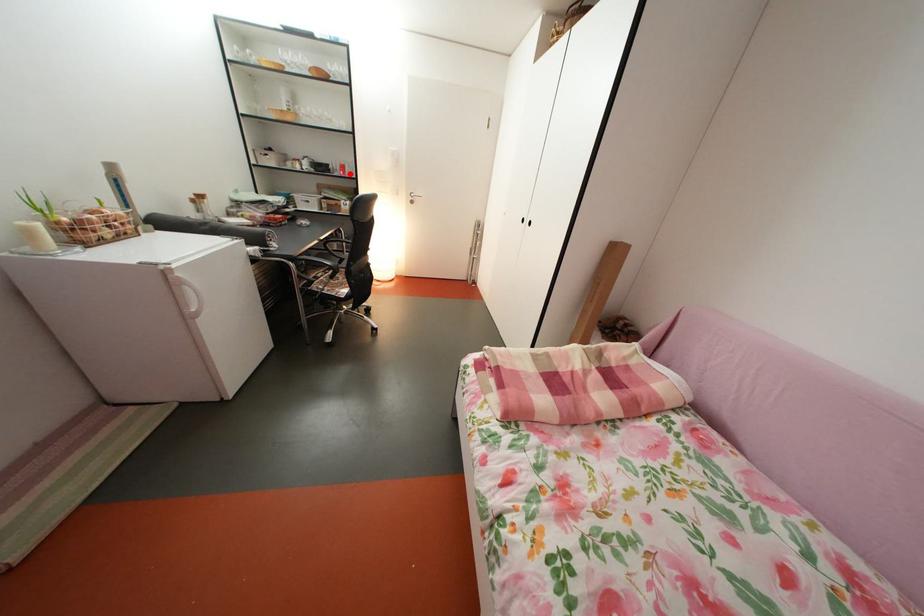
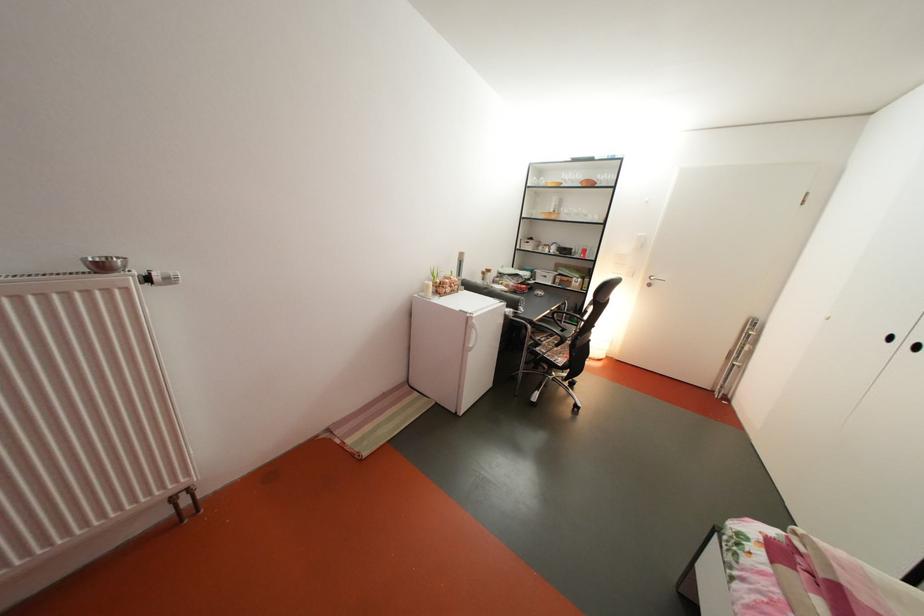
In the second image, find the point that corresponds to the highlighted location in the first image.

(591, 257)